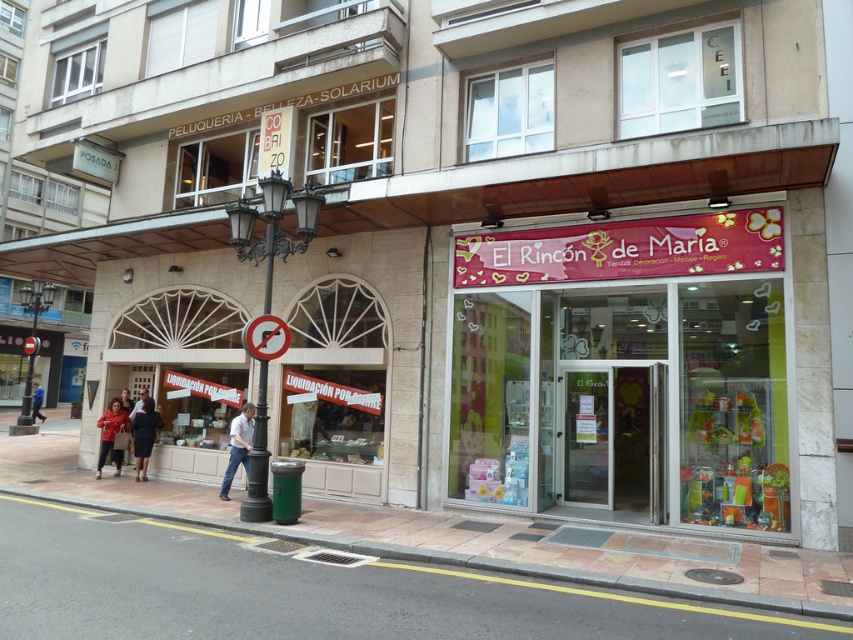
Is point (682, 426) positioned in front of point (16, 576)?

No, it is behind (16, 576).

This screenshot has width=853, height=640. Find the location of `pink fabric sign at center`. pink fabric sign at center is located at coordinates (624, 401).

Describe the element at coordinates (238, 445) in the screenshot. I see `light blue jeans at center` at that location.

Is light blue jeans at center positioned behind dark blue fabric coat at center?

No, light blue jeans at center is closer to the viewer.

Which is in front, point (235, 428) or point (135, 422)?

Point (235, 428)

This screenshot has width=853, height=640. Identify the location of light blue jeans at center. (238, 445).

Is smooth concrete pavement at lower center to the left of blue fabric pants at center from the viewer's perspective?

No, smooth concrete pavement at lower center is not to the left of blue fabric pants at center.

Between point (779, 625) and point (39, 397), which one is positioned in front?

Positioned in front is point (779, 625).

Locate an element on the screen. This screenshot has width=853, height=640. smooth concrete pavement at lower center is located at coordinates (306, 592).